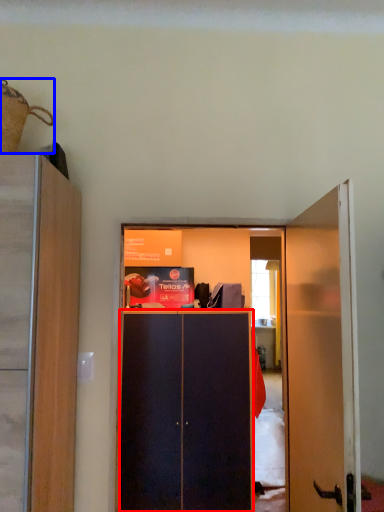
Question: Which object appears farthest to the camera in this image, screen door (highlighted by a red box) or houseplant (highlighted by a blue box)?

Choices:
 (A) screen door
 (B) houseplant

Answer: (A)